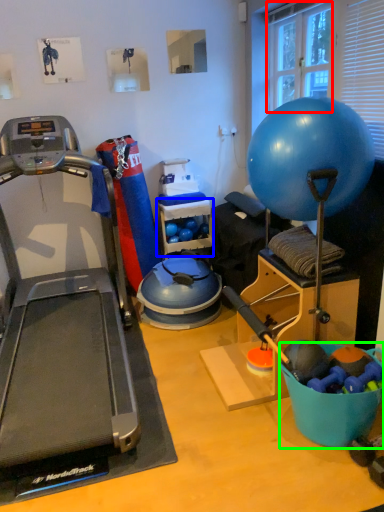
Question: Which object is positioned closest to window screen (highlighted by a red box)? Select from shelf (highlighted by a blue box) and bowl (highlighted by a green box).

Choices:
 (A) shelf
 (B) bowl

Answer: (A)